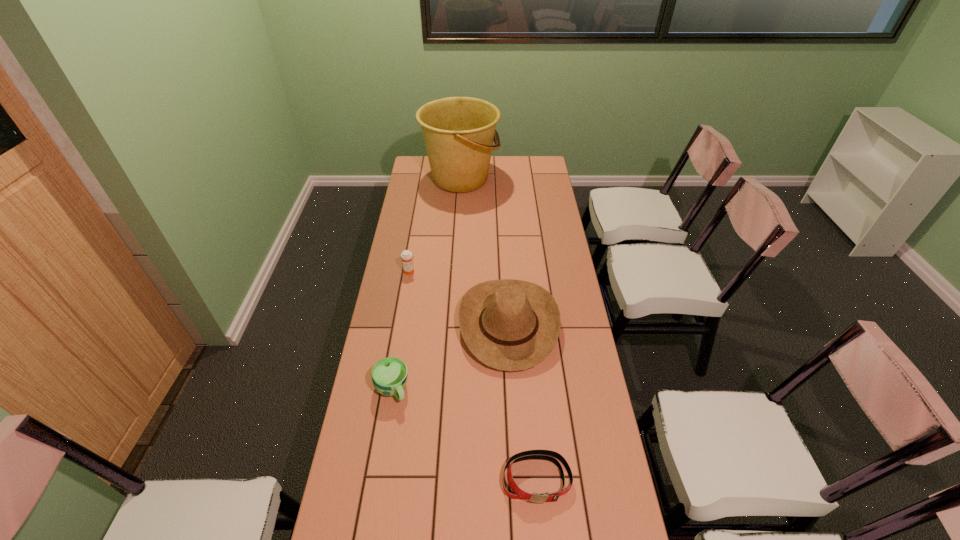
You are a GUI agent. You are given a task and a screenshot of the screen. Output one action in this format:
    pyautogui.click(x=<x>, y=<y>)
    Task: Click on the blank area located on the front-facing side of the second tallest object
    
    Given the screenshot: What is the action you would take?
    pyautogui.click(x=403, y=325)

Find the location of `vacant position located on the front-facing side of the second tallest object`. vacant position located on the front-facing side of the second tallest object is located at coordinates (414, 325).

The image size is (960, 540). In order to click on vacant space located on the right of the second farthest object in this screenshot , I will do `click(433, 271)`.

Locate an element on the screen. The width and height of the screenshot is (960, 540). vacant region located 0.340m on the right of the fourth tallest object is located at coordinates (513, 389).

Identify the location of free space located 0.250m on the back of the dog collar. (528, 381).

Find the location of a particular element. This screenshot has width=960, height=540. object that is at the far edge is located at coordinates (458, 132).

The height and width of the screenshot is (540, 960). Identify the location of bucket at the left edge. (458, 132).

Image resolution: width=960 pixels, height=540 pixels. I want to click on medicine that is at the left edge, so tap(406, 256).

Locate an element on the screen. The width and height of the screenshot is (960, 540). cup located in the left edge section of the desktop is located at coordinates (389, 375).

Identify the location of cowboy hat that is at the right edge. (511, 325).